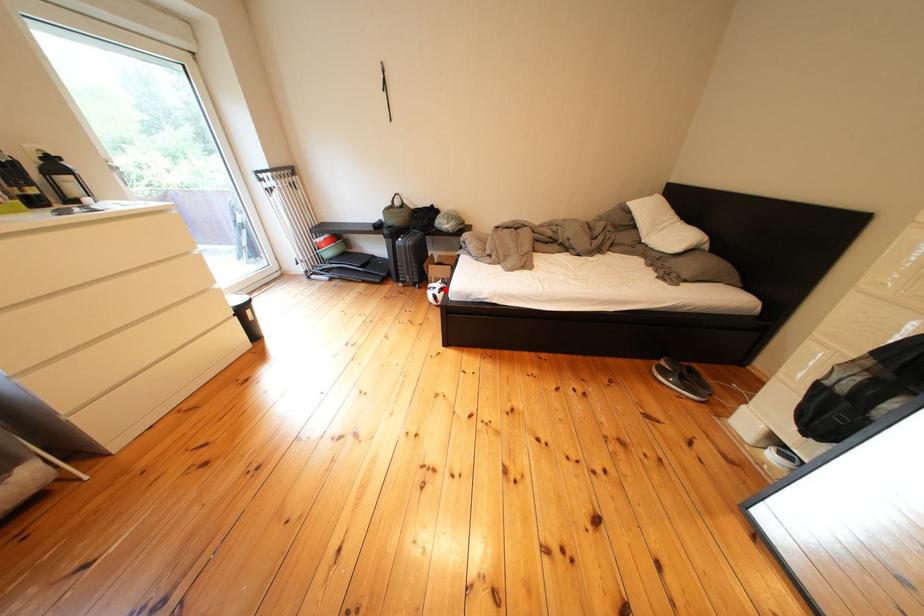
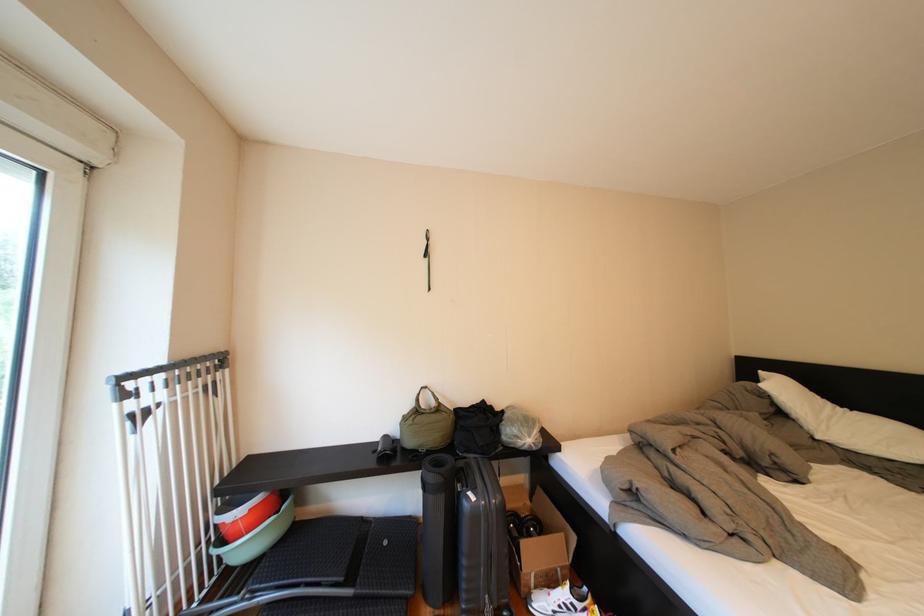
Question: I am providing you with two images of the same scene from different viewpoints. A red point is marked on the first image. Is the red point's position out of view in image 2?

Choices:
 (A) Yes
 (B) No

Answer: (B)